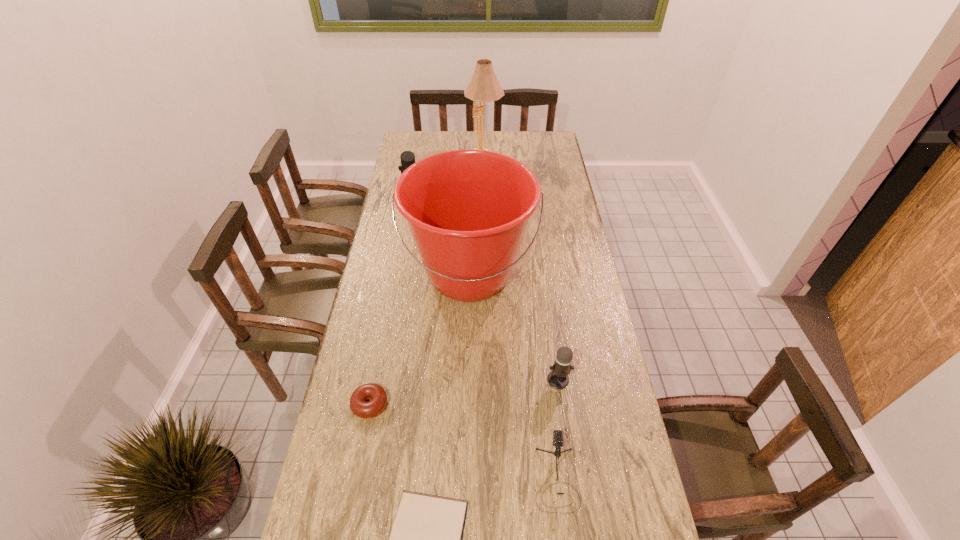
Where is `doughnut`? The image size is (960, 540). doughnut is located at coordinates (358, 405).

Locate an element on the screen. The height and width of the screenshot is (540, 960). vacant area situated on the left of the tallest object is located at coordinates (413, 153).

Locate an element on the screen. vacant space located with the handle attached to the rim of the second tallest object is located at coordinates (466, 435).

Identify the location of free space located on the right of the fifth shortest object. This screenshot has height=540, width=960. (463, 194).

You are a GUI agent. You are given a task and a screenshot of the screen. Output one action in this format:
    pyautogui.click(x=<x>, y=<y>)
    Task: Click on the free space located 0.140m on the front of the second shortest microphone
    The width and height of the screenshot is (960, 540).
    Given the screenshot: What is the action you would take?
    pyautogui.click(x=566, y=436)

Locate an element on the screen. vacant space situated on the back of the doughnut is located at coordinates (378, 359).

The height and width of the screenshot is (540, 960). What are the coordinates of `object at the far edge` in the screenshot? It's located at (483, 87).

The width and height of the screenshot is (960, 540). Find the location of `bucket positioned at the left edge`. bucket positioned at the left edge is located at coordinates (467, 210).

The image size is (960, 540). Identify the location of microphone that is at the left edge. [407, 158].

In order to click on doughnut that is at the left edge in this screenshot , I will do `click(358, 405)`.